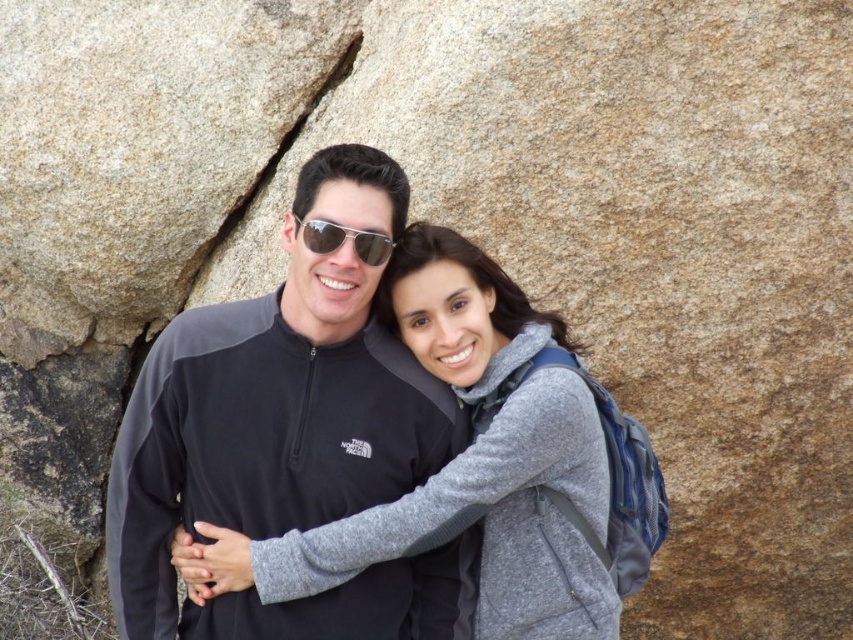
Question: Does matte black jacket at center have a lesser width compared to sunglasses at center?

Choices:
 (A) yes
 (B) no

Answer: (B)

Question: Does matte black jacket at center have a smaller size compared to sunglasses at center?

Choices:
 (A) yes
 (B) no

Answer: (B)

Question: Is matte black jacket at center positioned before sunglasses at center?

Choices:
 (A) no
 (B) yes

Answer: (A)

Question: Among these points, which one is farthest from the camera?

Choices:
 (A) (337, 228)
 (B) (219, 486)

Answer: (B)

Question: Which point is closer to the camera?

Choices:
 (A) (345, 236)
 (B) (373, 284)

Answer: (A)